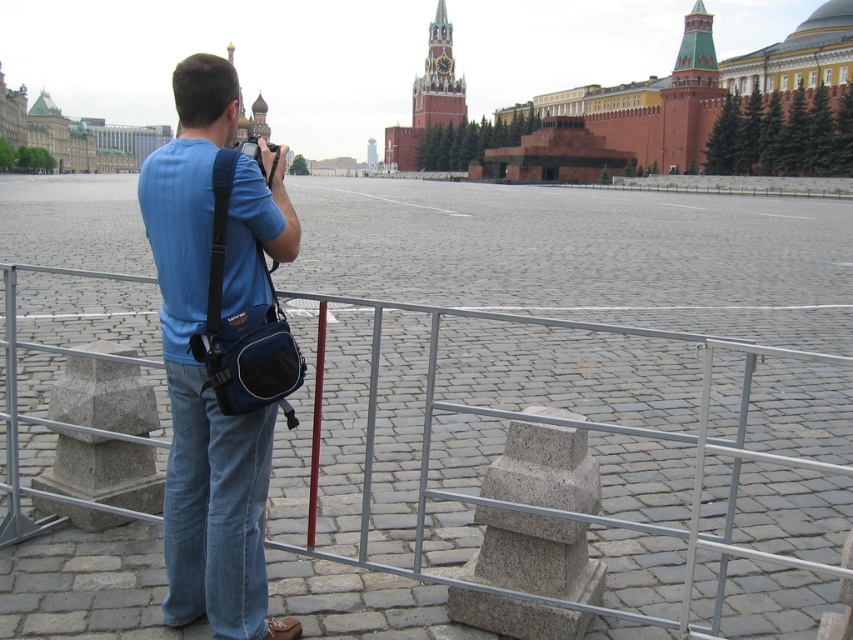
You are a traveler standing in Red Square, Moscow. You have a blue fabric bag at center and a metallic silver fence at center in front of you. Which object is taller?

The blue fabric bag at center is taller than the metallic silver fence at center.

You are a tourist in Moscow holding a blue fabric bag at center and standing near a metallic silver fence at center. You want to place your bag on the ground next to the fence. Will the bag fit entirely next to the fence without overlapping it?

The blue fabric bag at center has a lesser width compared to metallic silver fence at center, so it can fit entirely next to the fence without overlapping it.